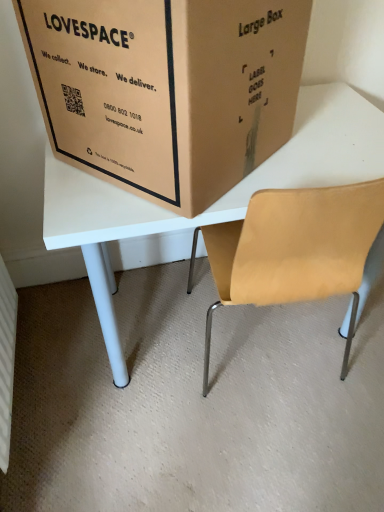
Describe the element at coordinates (166, 89) in the screenshot. I see `brown cardboard box at upper center` at that location.

Where is `brown cardboard box at upper center`? brown cardboard box at upper center is located at coordinates (166, 89).

Describe the element at coordinates (220, 198) in the screenshot. I see `matte white table at center` at that location.

The width and height of the screenshot is (384, 512). In order to click on matte white table at center in this screenshot , I will do `click(220, 198)`.

The width and height of the screenshot is (384, 512). I want to click on brown cardboard box at upper center, so click(x=166, y=89).

Between brown cardboard box at upper center and matte white table at center, which one appears on the left side from the viewer's perspective?

From the viewer's perspective, brown cardboard box at upper center appears more on the left side.

Is the depth of brown cardboard box at upper center greater than that of matte white table at center?

No, brown cardboard box at upper center is closer to the viewer.

Considering the positions of point (92, 100) and point (375, 117), is point (92, 100) closer or farther from the camera than point (375, 117)?

Point (92, 100) appears to be closer to the viewer than point (375, 117).

From the image's perspective, which is below, brown cardboard box at upper center or matte white table at center?

matte white table at center is shown below in the image.

From a real-world perspective, is brown cardboard box at upper center beneath matte white table at center?

Actually, brown cardboard box at upper center is physically above matte white table at center in the real world.

Can you confirm if brown cardboard box at upper center is wider than matte white table at center?

No, brown cardboard box at upper center is not wider than matte white table at center.

Considering the relative sizes of brown cardboard box at upper center and matte white table at center in the image provided, is brown cardboard box at upper center shorter than matte white table at center?

Yes.

Who is smaller, brown cardboard box at upper center or matte white table at center?

brown cardboard box at upper center is smaller.

Would you say brown cardboard box at upper center is outside matte white table at center?

brown cardboard box at upper center is positioned outside matte white table at center.

Is brown cardboard box at upper center touching matte white table at center?

No, brown cardboard box at upper center is not with matte white table at center.

Is brown cardboard box at upper center aimed at matte white table at center?

No, brown cardboard box at upper center is not facing towards matte white table at center.

How much distance is there between brown cardboard box at upper center and matte white table at center?

A distance of 8.25 inches exists between brown cardboard box at upper center and matte white table at center.

You are a GUI agent. You are given a task and a screenshot of the screen. Output one action in this format:
    pyautogui.click(x=<x>, y=<y>)
    Task: Click on the box in front of the matte white table at center
    
    Given the screenshot: What is the action you would take?
    pyautogui.click(x=166, y=89)

Does matte white table at center appear on the right side of brown cardboard box at upper center?

A: Yes, matte white table at center is to the right of brown cardboard box at upper center.

Which object is further away from the camera taking this photo, matte white table at center or brown cardboard box at upper center?

matte white table at center is further from the camera.

Is point (294, 124) positioned before point (204, 76)?

No, it is behind (204, 76).

From the image's perspective, between matte white table at center and brown cardboard box at upper center, who is located below?

matte white table at center, from the image's perspective.

From a real-world perspective, is matte white table at center positioned over brown cardboard box at upper center based on gravity?

No, from a real-world perspective, matte white table at center is not above brown cardboard box at upper center.

Which of these two, matte white table at center or brown cardboard box at upper center, is wider?

matte white table at center is wider.

In terms of height, does matte white table at center look taller or shorter compared to brown cardboard box at upper center?

In the image, matte white table at center appears to be taller than brown cardboard box at upper center.

Does matte white table at center have a larger size compared to brown cardboard box at upper center?

Yes.

Is brown cardboard box at upper center located within matte white table at center?

No, matte white table at center does not contain brown cardboard box at upper center.

Are matte white table at center and brown cardboard box at upper center far apart?

Actually, matte white table at center and brown cardboard box at upper center are a little close together.

Could you tell me if matte white table at center is facing brown cardboard box at upper center?

No, matte white table at center is not turned towards brown cardboard box at upper center.

Find the location of a particular element. The height and width of the screenshot is (512, 384). table located below the brown cardboard box at upper center (from the image's perspective) is located at coordinates (220, 198).

Identify the location of table on the right of brown cardboard box at upper center. The width and height of the screenshot is (384, 512). (220, 198).

At what (x,y) coordinates should I click in order to perform the action: click on table below the brown cardboard box at upper center (from the image's perspective). Please return your answer as a coordinate pair (x, y). This screenshot has width=384, height=512. Looking at the image, I should click on (220, 198).